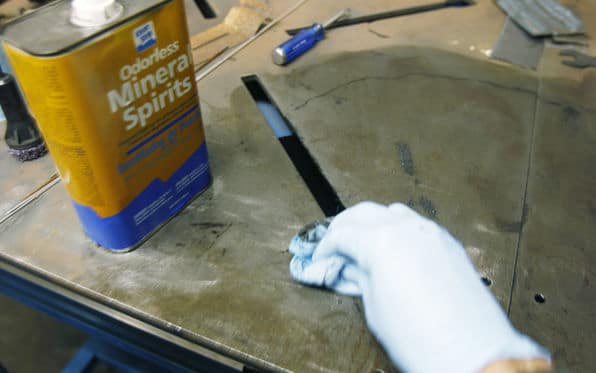
This screenshot has width=596, height=373. Identify the location of cleaning a table. coord(334,259).